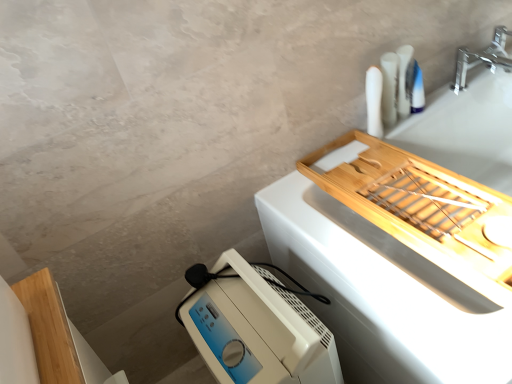
Question: From the image's perspective, is white plastic toothbrush at upper right, acting as the first toiletry starting from the left, above or below white matte toothpaste tubes at upper right, the second toiletry in the right-to-left sequence?

Choices:
 (A) below
 (B) above

Answer: (A)

Question: In terms of size, does white plastic toothbrush at upper right, acting as the first toiletry starting from the left, appear bigger or smaller than white matte toothpaste tubes at upper right, which is counted as the 2th toiletry, starting from the left?

Choices:
 (A) small
 (B) big

Answer: (B)

Question: Based on their relative distances, which object is nearer to the natural wood tray at upper right?

Choices:
 (A) white plastic toothbrush at upper right, acting as the first toiletry starting from the left
 (B) white plastic humidifier at lower left
 (C) white matte toothpaste tubes at upper right, the second toiletry in the right-to-left sequence
 (D) silver metallic faucet at upper right
 (E) white plastic toothpaste tube at upper right, acting as the 3th toiletry starting from the left

Answer: (B)

Question: Considering the real-world distances, which object is closest to the silver metallic faucet at upper right?

Choices:
 (A) white plastic toothpaste tube at upper right, which ranks as the 1th toiletry in right-to-left order
 (B) white matte toothpaste tubes at upper right, which is counted as the 2th toiletry, starting from the left
 (C) natural wood tray at upper right
 (D) white plastic toothbrush at upper right, which is the 3th toiletry from right to left
 (E) white plastic humidifier at lower left

Answer: (A)